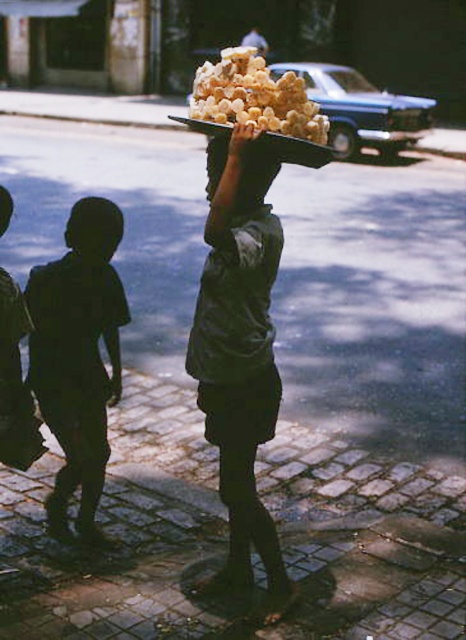
You are a customer observing the street scene. You notice the golden crispy pastry at center and the black matte head at center. Which object is taller in the image?

The golden crispy pastry at center is much taller than the black matte head at center.

You are a customer at a street market and see the golden crispy pastry at center and the smooth black head at upper left. Which item is bigger?

The golden crispy pastry at center is larger in size than the smooth black head at upper left.